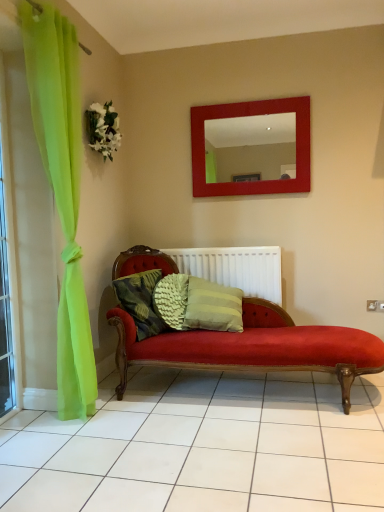
Locate an element on the screen. The height and width of the screenshot is (512, 384). white fabric flower at upper left is located at coordinates (103, 129).

I want to click on white plastic radiator at center, so click(235, 268).

Describe the element at coordinates (140, 301) in the screenshot. I see `textured green pillow at center` at that location.

Where is `white fabric flower at upper left`? white fabric flower at upper left is located at coordinates (103, 129).

Identify the location of flower above the white plastic radiator at center (from the image's perspective). (103, 129).

How different are the orientations of white plastic radiator at center and white fabric flower at upper left in degrees?

93.8 degrees.

Based on the photo, considering the relative sizes of white plastic radiator at center and white fabric flower at upper left in the image provided, is white plastic radiator at center shorter than white fabric flower at upper left?

No, white plastic radiator at center is not shorter than white fabric flower at upper left.

Which is behind, point (153, 286) or point (245, 262)?

Point (245, 262)

How distant is textured green pillow at center from white plastic radiator at center?

textured green pillow at center and white plastic radiator at center are 22.88 inches apart.

In the image, there is a white plastic radiator at center. Where is `pillow below it (from the image's perspective)`? The image size is (384, 512). pillow below it (from the image's perspective) is located at coordinates (140, 301).

Is textured green pillow at center next to white plastic radiator at center and touching it?

No, textured green pillow at center is not with white plastic radiator at center.

Considering the sizes of white plastic radiator at center and clear glass window at left in the image, is white plastic radiator at center wider or thinner than clear glass window at left?

white plastic radiator at center is wider than clear glass window at left.

Looking at this image, can you tell me how much white plastic radiator at center and clear glass window at left differ in facing direction?

The angular difference between white plastic radiator at center and clear glass window at left is 85.8 degrees.

Do you think white plastic radiator at center is within clear glass window at left, or outside of it?

white plastic radiator at center is outside clear glass window at left.

Identify the location of flower above the textured green pillow at center (from a real-world perspective). (103, 129).

Choose the correct answer: Is white fabric flower at upper left inside textured green pillow at center or outside it?

white fabric flower at upper left is located beyond the bounds of textured green pillow at center.

Considering the sizes of objects white fabric flower at upper left and textured green pillow at center in the image provided, who is smaller, white fabric flower at upper left or textured green pillow at center?

Smaller between the two is white fabric flower at upper left.

Is white fabric flower at upper left wider or thinner than textured green pillow at center?

In the image, white fabric flower at upper left appears to be more narrow than textured green pillow at center.

From the image's perspective, is white fabric flower at upper left positioned above or below clear glass window at left?

Clearly, from the image's perspective, white fabric flower at upper left is above clear glass window at left.

Is white fabric flower at upper left beside clear glass window at left?

No, white fabric flower at upper left is not in contact with clear glass window at left.

Does white fabric flower at upper left have a lesser height compared to clear glass window at left?

Yes.

Can you confirm if white fabric flower at upper left is positioned to the left of clear glass window at left?

In fact, white fabric flower at upper left is to the right of clear glass window at left.

Is textured green pillow at center bigger than white fabric flower at upper left?

A: Yes.

Which is more to the right, textured green pillow at center or white fabric flower at upper left?

textured green pillow at center.

Which object is more forward, textured green pillow at center or white fabric flower at upper left?

Answer: Positioned in front is textured green pillow at center.

From the image's perspective, is textured green pillow at center under white fabric flower at upper left?

Yes, from the image's perspective, textured green pillow at center is below white fabric flower at upper left.

From the image's perspective, which is below, textured green pillow at center or clear glass window at left?

textured green pillow at center.

Considering the points (140, 322) and (0, 289), which point is behind, point (140, 322) or point (0, 289)?

The point (140, 322) is farther.

Looking at this image, would you consider textured green pillow at center to be distant from clear glass window at left?

No, textured green pillow at center is in close proximity to clear glass window at left.

Considering the positions of objects textured green pillow at center and clear glass window at left in the image provided, who is more to the left, textured green pillow at center or clear glass window at left?

From the viewer's perspective, clear glass window at left appears more on the left side.

The width and height of the screenshot is (384, 512). In order to click on flower to the left of white plastic radiator at center in this screenshot , I will do `click(103, 129)`.

Find the location of a particular element. The image size is (384, 512). pillow in front of the white plastic radiator at center is located at coordinates (140, 301).

Based on their spatial positions, is textured green pillow at center or red glossy mirror at upper center further from white fabric flower at upper left?

Based on the image, textured green pillow at center appears to be further to white fabric flower at upper left.

Considering their positions, is white fabric flower at upper left positioned closer to clear glass window at left than textured green pillow at center?

The object closer to clear glass window at left is textured green pillow at center.

From the image, which object appears to be nearer to textured green pillow at center, white plastic radiator at center or clear glass window at left?

white plastic radiator at center.

Which object lies further to the anchor point white plastic radiator at center, textured green pillow at center or white fabric flower at upper left?

white fabric flower at upper left.

Which object lies nearer to the anchor point white fabric flower at upper left, white plastic radiator at center or textured green pillow at center?

textured green pillow at center.

Which object lies further to the anchor point red glossy mirror at upper center, textured green pillow at center or white fabric flower at upper left?

The object further to red glossy mirror at upper center is textured green pillow at center.

Which object lies nearer to the anchor point red glossy mirror at upper center, textured green pillow at center or clear glass window at left?

textured green pillow at center is positioned closer to the anchor red glossy mirror at upper center.

Estimate the real-world distances between objects in this image. Which object is further from clear glass window at left, white plastic radiator at center or textured green pillow at center?

white plastic radiator at center is further to clear glass window at left.

Find the location of a particular element. This screenshot has height=512, width=384. flower situated between clear glass window at left and white plastic radiator at center from left to right is located at coordinates (103, 129).

What are the coordinates of `radiator between red glossy mirror at upper center and textured green pillow at center in the vertical direction` in the screenshot? It's located at pos(235,268).

This screenshot has width=384, height=512. What are the coordinates of `radiator situated between clear glass window at left and red glossy mirror at upper center from left to right` in the screenshot? It's located at (235, 268).

Image resolution: width=384 pixels, height=512 pixels. Identify the location of flower located between clear glass window at left and red glossy mirror at upper center in the left-right direction. (103, 129).